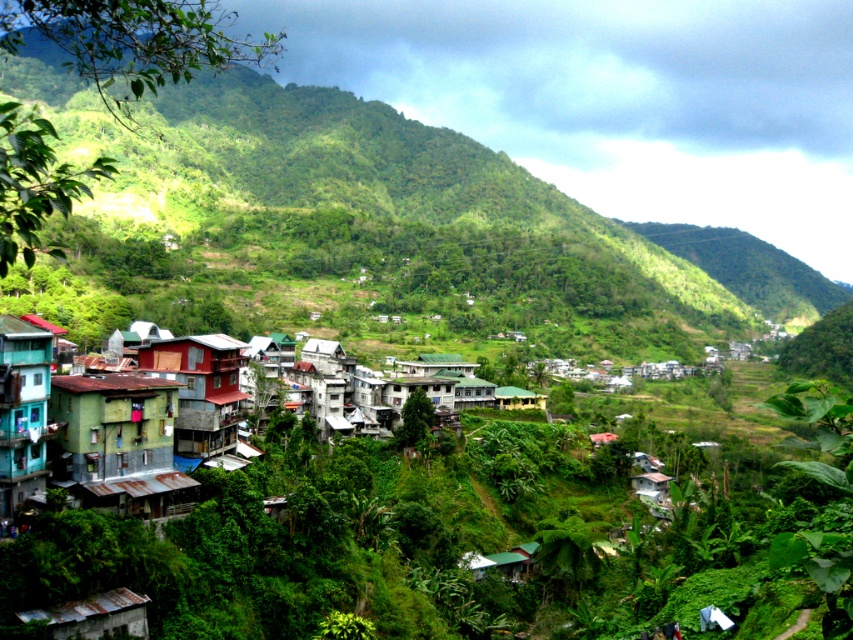
You are a hiker who wants to reach the village located at the base of the mountain. You are currently standing at point A, which is at the bottom left corner of the image. There is a green leafy hillside at center at point B, which is at point (457, 188). To avoid the steep hillside, which direction should you head towards to reach the village?

The green leafy hillside at center is located at point (457, 188), so to avoid the steep hillside, you should head towards the right direction from point A to reach the village.